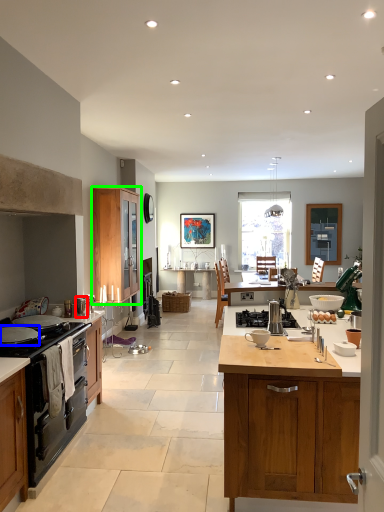
Question: Which object is the farthest from appliance (highlighted by a red box)? Choose among these: kitchen appliance (highlighted by a blue box) or cabinetry (highlighted by a green box).

Choices:
 (A) kitchen appliance
 (B) cabinetry

Answer: (B)